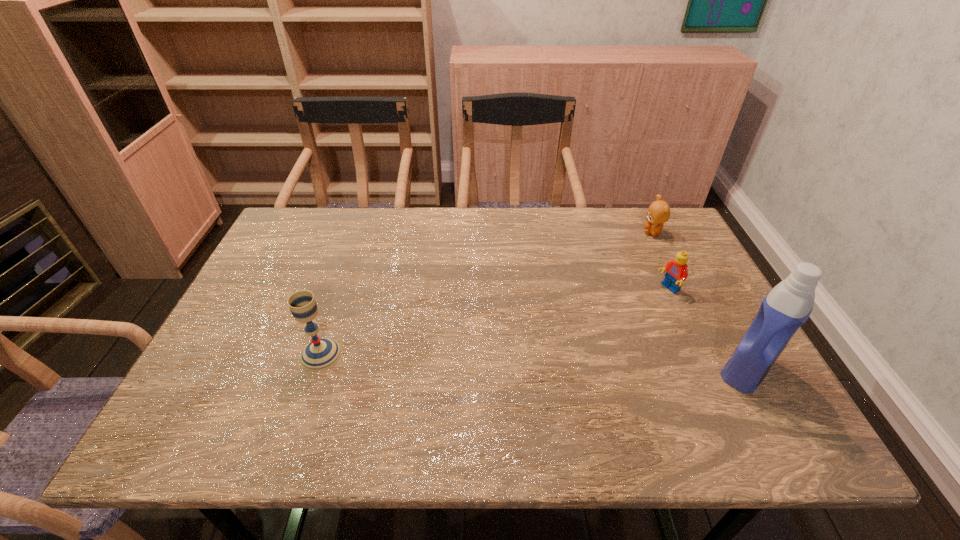
The width and height of the screenshot is (960, 540). In the image, there is a desktop. In order to click on vacant space at the far edge in this screenshot , I will do `click(425, 209)`.

Locate an element on the screen. Image resolution: width=960 pixels, height=540 pixels. free spot at the near edge of the desktop is located at coordinates (370, 394).

Where is `free location at the left edge of the desktop`? free location at the left edge of the desktop is located at coordinates (273, 271).

The width and height of the screenshot is (960, 540). I want to click on free space at the right edge of the desktop, so click(714, 361).

In the image, there is a desktop. What are the coordinates of `vacant space at the far left corner` in the screenshot? It's located at (317, 252).

In the image, there is a desktop. At what (x,y) coordinates should I click in order to perform the action: click on vacant space at the far right corner. Please return your answer as a coordinate pair (x, y). Looking at the image, I should click on (643, 236).

I want to click on vacant area that lies between the teddy bear and the tallest object, so click(700, 301).

Identify the location of free space between the Lego and the chalice. (494, 322).

Locate an element on the screen. The width and height of the screenshot is (960, 540). vacant area that lies between the chalice and the Lego is located at coordinates (494, 322).

I want to click on free space between the leftmost object and the tallest object, so click(534, 362).